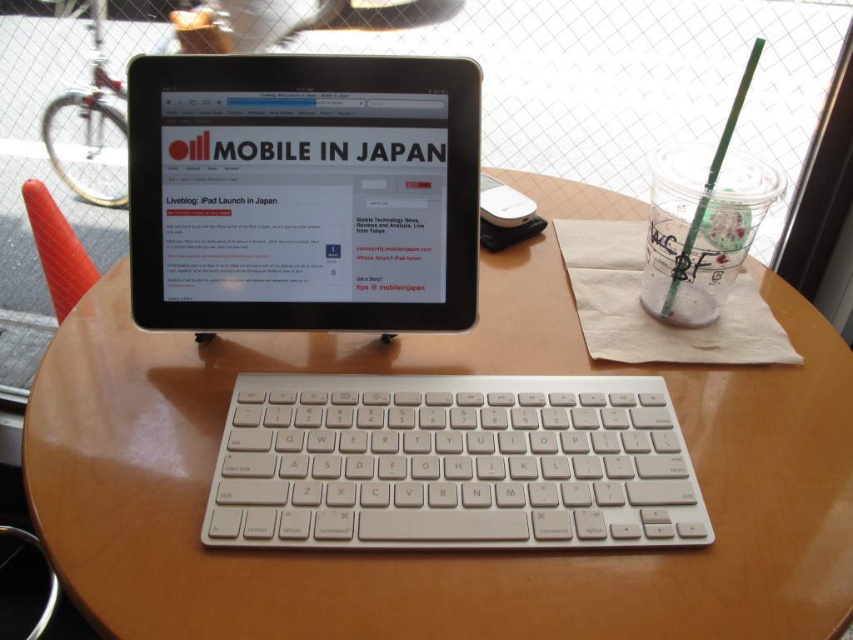
Between point (825, 632) and point (550, 531), which one is positioned in front?

Point (825, 632) is in front.

Which of these two, wooden table at center or white plastic keyboard at center, stands shorter?

Standing shorter between the two is white plastic keyboard at center.

The width and height of the screenshot is (853, 640). Describe the element at coordinates (430, 550) in the screenshot. I see `wooden table at center` at that location.

Locate an element on the screen. wooden table at center is located at coordinates (430, 550).

Which is below, wooden table at center or black glossy tablet at center?

wooden table at center is below.

Find the location of a particular element. The height and width of the screenshot is (640, 853). wooden table at center is located at coordinates (430, 550).

Locate an element on the screen. Image resolution: width=853 pixels, height=640 pixels. wooden table at center is located at coordinates pos(430,550).

Can you confirm if black glossy tablet at center is positioned below white plastic keyboard at center?

No, black glossy tablet at center is not below white plastic keyboard at center.

Is black glossy tablet at center above white plastic keyboard at center?

Indeed, black glossy tablet at center is positioned over white plastic keyboard at center.

Consider the image. Who is more distant from viewer, (229, 65) or (489, 422)?

The point (229, 65) is more distant.

I want to click on black glossy tablet at center, so [x=303, y=193].